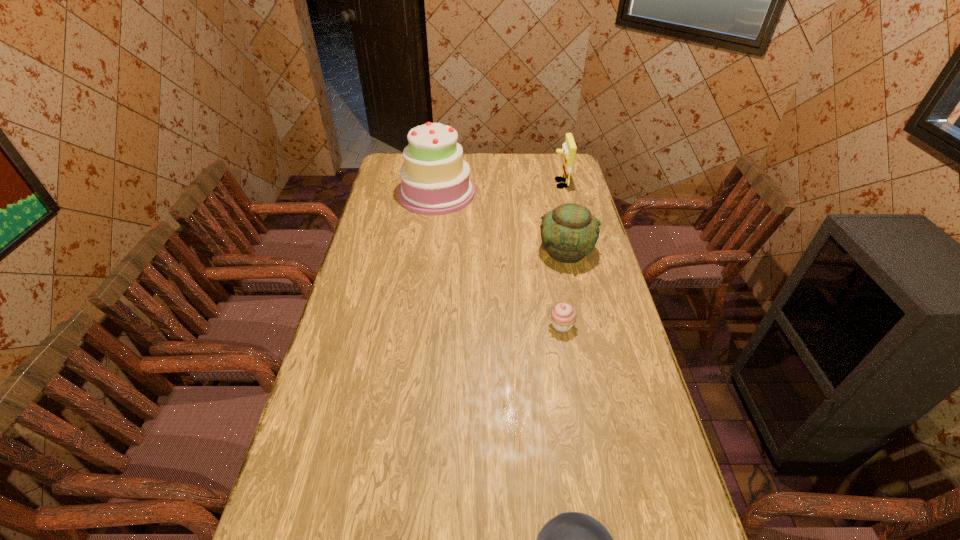
Locate an element on the screen. blank area in the image that satisfies the following two spatial constraints: 1. on the front side of the tallest object; 2. on the right side of the third farthest object is located at coordinates (429, 251).

In order to click on vacant space that satisfies the following two spatial constraints: 1. on the face of the second tallest object; 2. on the front side of the second shortest object in this screenshot , I will do `click(595, 326)`.